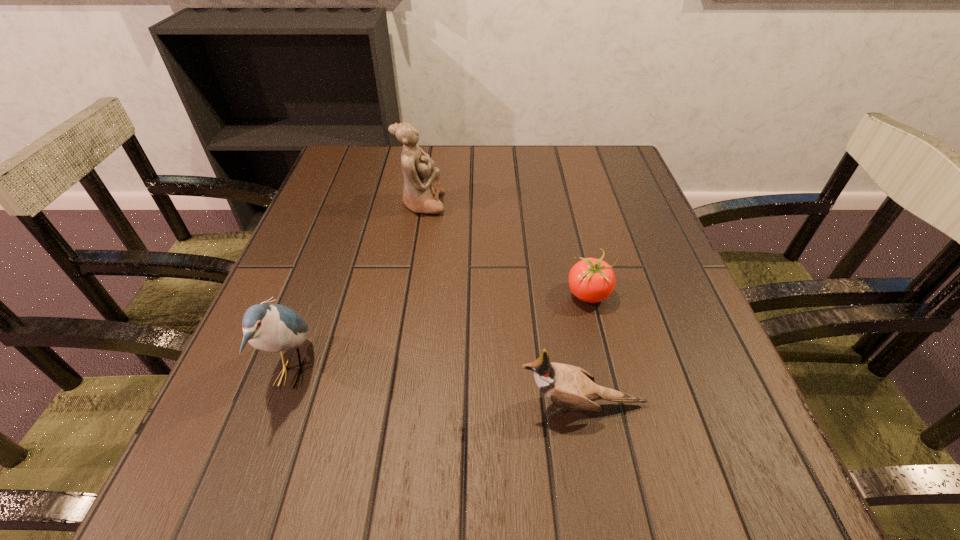
Find the location of a particular element. The height and width of the screenshot is (540, 960). free spot at the left edge of the desktop is located at coordinates (312, 252).

At what (x,y) coordinates should I click in order to perform the action: click on blank space at the right edge. Please return your answer as a coordinate pair (x, y). This screenshot has height=540, width=960. Looking at the image, I should click on [x=628, y=322].

At what (x,y) coordinates should I click in order to perform the action: click on vacant region at the far left corner of the desktop. Please return your answer as a coordinate pair (x, y). Looking at the image, I should click on (351, 145).

What are the coordinates of `free point at the near left corner` in the screenshot? It's located at (225, 525).

Image resolution: width=960 pixels, height=540 pixels. In the image, there is a desktop. Find the location of `free space at the far right corner`. free space at the far right corner is located at coordinates (581, 171).

In order to click on vacant space at the near right corner of the desktop in this screenshot , I will do `click(666, 496)`.

Locate an element on the screen. The height and width of the screenshot is (540, 960). free space between the third tallest object and the second object from left to right is located at coordinates (502, 304).

Identify the location of free space between the tallest object and the third shortest object. This screenshot has height=540, width=960. (357, 288).

At what (x,y) coordinates should I click in order to perform the action: click on unoccupied position between the taller bird and the second shortest object. Please return your answer as a coordinate pair (x, y). The width and height of the screenshot is (960, 540). Looking at the image, I should click on (437, 389).

Where is `vacant space in between the left bird and the tallest object`? The image size is (960, 540). vacant space in between the left bird and the tallest object is located at coordinates (357, 288).